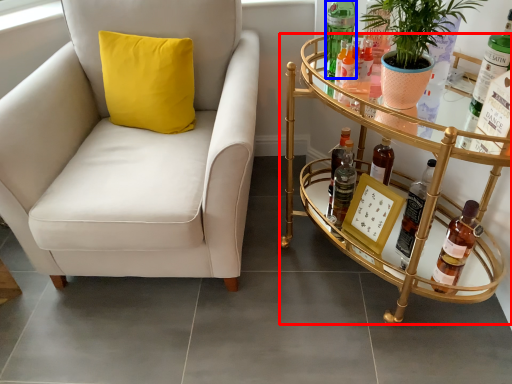
Question: Which object appears closest to the camera in this image, table (highlighted by a red box) or bottle (highlighted by a blue box)?

Choices:
 (A) table
 (B) bottle

Answer: (A)